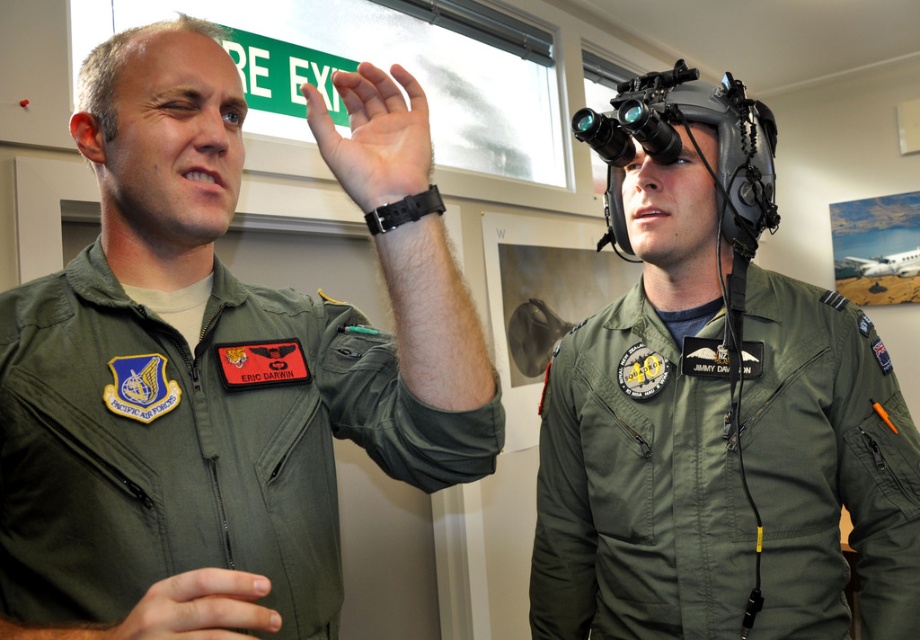
Does matte green helmet at upper center appear on the right side of matte gray helmet at center?

Incorrect, matte green helmet at upper center is not on the right side of matte gray helmet at center.

Is matte green helmet at upper center above matte gray helmet at center?

Actually, matte green helmet at upper center is below matte gray helmet at center.

Between point (852, 305) and point (765, 177), which one is positioned in front?

Point (852, 305) is in front.

In order to click on matte green helmet at upper center in this screenshot , I will do `click(715, 408)`.

Is point (177, 250) behind point (743, 248)?

No, it is in front of (743, 248).

Is green matte uniform at upper left in front of matte gray helmet at center?

Yes, it is.

Identify the location of green matte uniform at upper left. (220, 355).

How far apart are green matte uniform at upper left and skinny flesh at lower left?

green matte uniform at upper left is 10.28 inches from skinny flesh at lower left.

Does green matte uniform at upper left lie in front of skinny flesh at lower left?

No, green matte uniform at upper left is further to the viewer.

Is point (144, 429) positioned in front of point (141, 636)?

No, (144, 429) is further to viewer.

The height and width of the screenshot is (640, 920). In order to click on green matte uniform at upper left in this screenshot , I will do `click(220, 355)`.